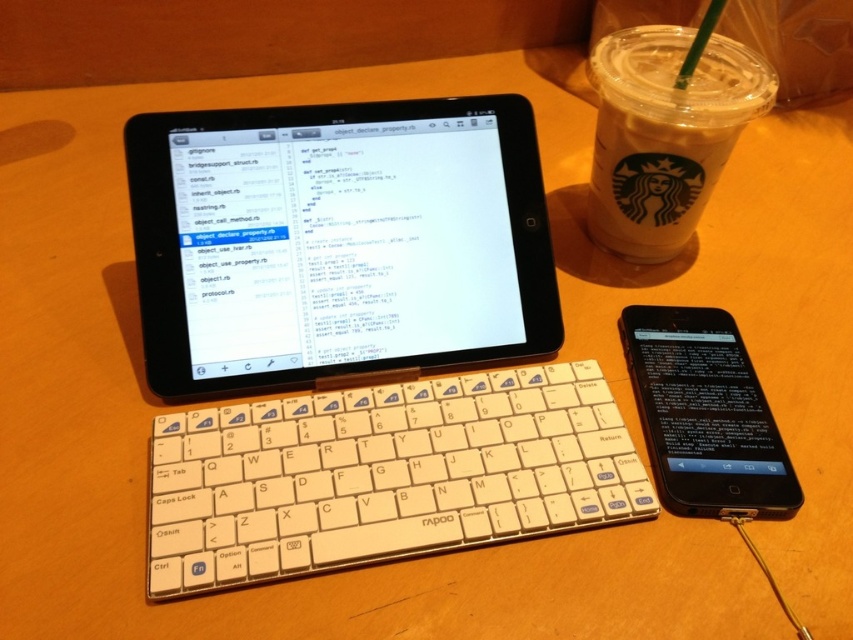
Can you confirm if black matte tablet at upper center is thinner than black glossy phone at center?

No.

Between point (460, 289) and point (653, 384), which one is positioned behind?

Point (460, 289)

You are a GUI agent. You are given a task and a screenshot of the screen. Output one action in this format:
    pyautogui.click(x=<x>, y=<y>)
    Task: Click on the black matte tablet at upper center
    
    Given the screenshot: What is the action you would take?
    pyautogui.click(x=337, y=241)

Which is in front, point (306, 198) or point (679, 45)?

Point (306, 198) is in front.

Who is positioned more to the left, black matte tablet at upper center or white paper cup at upper right?

black matte tablet at upper center

Identify the location of black matte tablet at upper center. (337, 241).

Locate an element on the screen. Image resolution: width=853 pixels, height=640 pixels. black matte tablet at upper center is located at coordinates (337, 241).

Is point (619, 509) positioned after point (650, 65)?

No, (619, 509) is closer to viewer.

Between white plastic keyboard at center and white paper cup at upper right, which one has more height?

Standing taller between the two is white paper cup at upper right.

Measure the distance between white plastic keyboard at center and camera.

A distance of 25.02 inches exists between white plastic keyboard at center and camera.

What are the coordinates of `white plastic keyboard at center` in the screenshot? It's located at (386, 474).